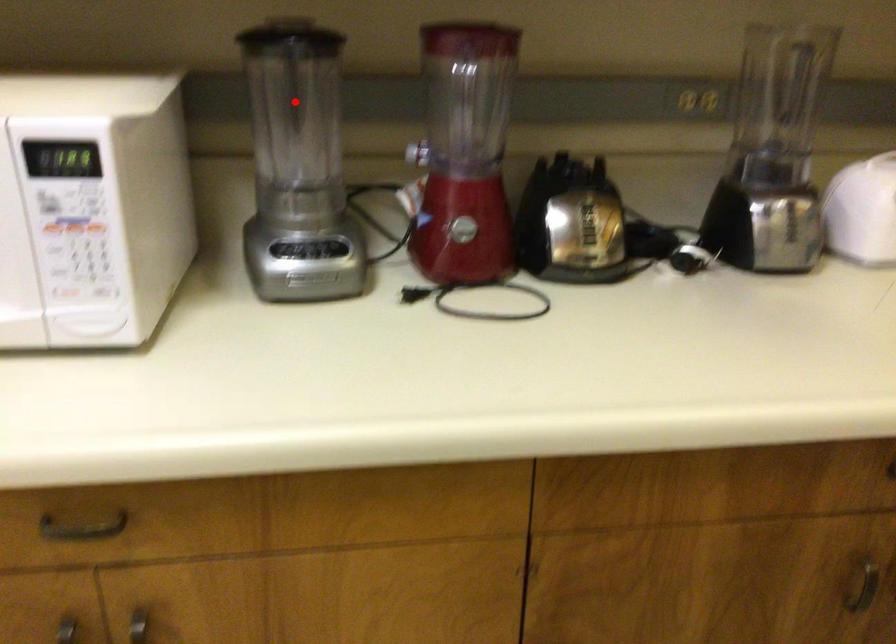
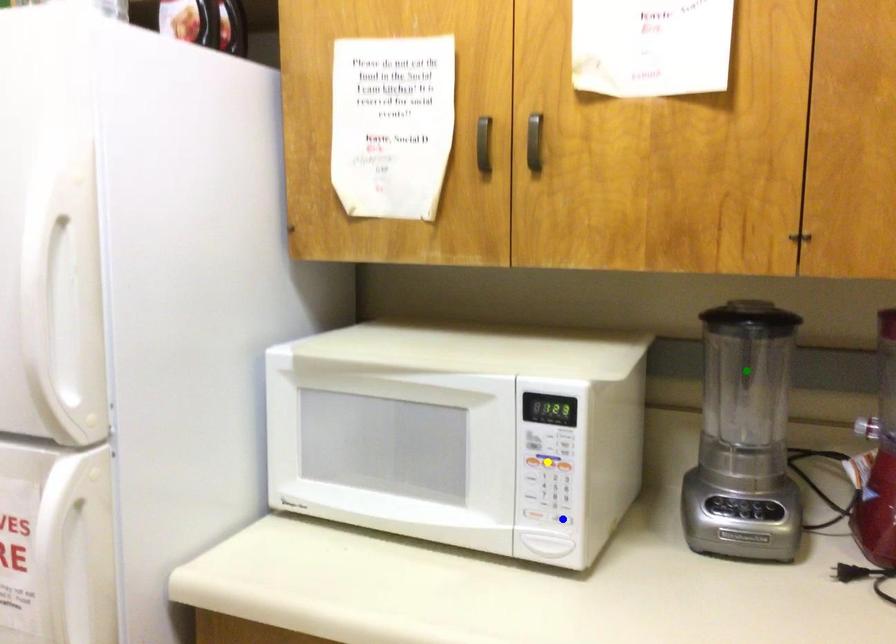
Question: I am providing you with two images of the same scene from different viewpoints. A red point is marked on the first image. You are given multiple points on the second image. Which spot in image 2 lines up with the point in image 1?

Choices:
 (A) yellow point
 (B) green point
 (C) blue point

Answer: (B)